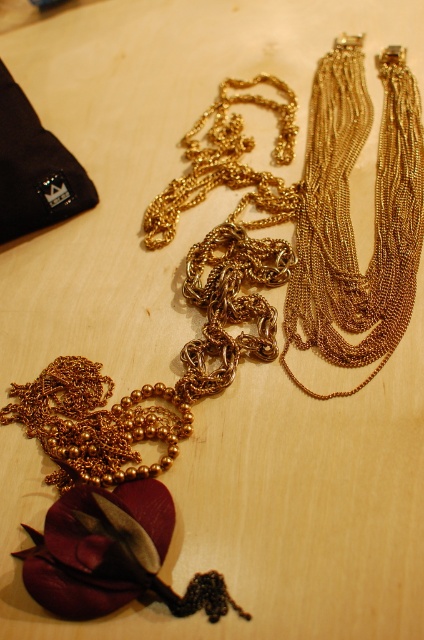
Is point (360, 332) positioned after point (145, 502)?

Yes, it is behind point (145, 502).

Is point (407, 308) positioned in front of point (47, 532)?

That is False.

This screenshot has width=424, height=640. Identify the location of gold chain at upper right. (349, 216).